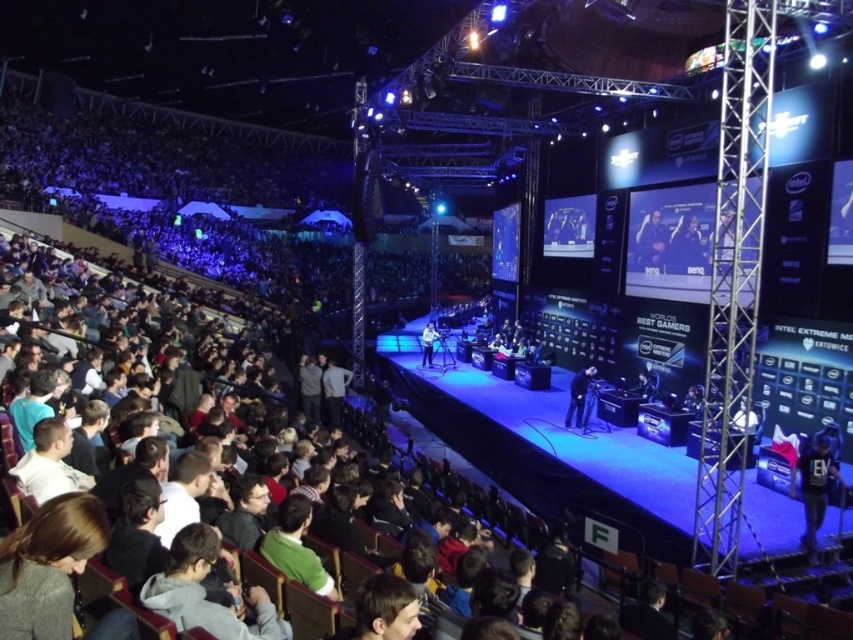
Is point (792, 467) farther from camera compared to point (651, 260)?

No, it is in front of (651, 260).

Is black fabric at center positioned at the back of dark blue leather jacket at center?

That is False.

Where is `black fabric at center`? The width and height of the screenshot is (853, 640). black fabric at center is located at coordinates (813, 488).

Is point (816, 458) more distant than point (572, 417)?

No.

In the scene shown: Is the position of black fabric at center more distant than that of dark gray suit at center?

No, black fabric at center is in front of dark gray suit at center.

Between point (822, 436) and point (582, 392), which one is positioned behind?

The point (582, 392) is more distant.

At what (x,y) coordinates should I click in order to perform the action: click on black fabric at center. Please return your answer as a coordinate pair (x, y). The height and width of the screenshot is (640, 853). Looking at the image, I should click on tap(813, 488).

Which is behind, point (817, 509) or point (675, 268)?

The point (675, 268) is more distant.

Can you confirm if black fabric at center is smaller than smooth skin face at upper center?

Indeed, black fabric at center has a smaller size compared to smooth skin face at upper center.

Identify the location of black fabric at center. Image resolution: width=853 pixels, height=640 pixels. (813, 488).